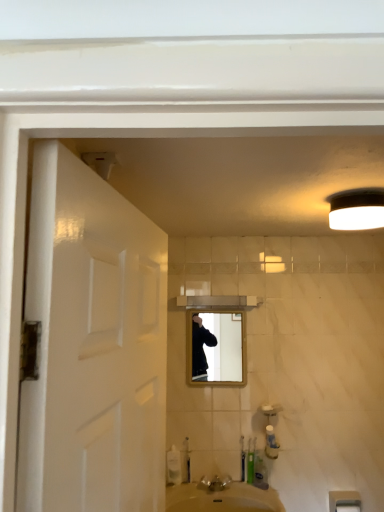
Image resolution: width=384 pixels, height=512 pixels. In order to click on green plastic toothbrush at lower center in this screenshot , I will do `click(250, 460)`.

Describe the element at coordinates (215, 483) in the screenshot. Image resolution: width=384 pixels, height=512 pixels. I see `silver metallic faucet at lower center` at that location.

Describe the element at coordinates (357, 209) in the screenshot. The height and width of the screenshot is (512, 384). I see `white matte light fixture at upper right` at that location.

What is the approximate width of white plastic soap dispenser at lower center?

The width of white plastic soap dispenser at lower center is 1.40 inches.

Locate an element on the screen. Image resolution: width=384 pixels, height=512 pixels. green plastic toothbrush at lower center is located at coordinates (250, 460).

Is white matte door at left spatially inside white plastic towel bar at lower right, or outside of it?

white matte door at left is outside white plastic towel bar at lower right.

Is point (102, 207) farther from viewer compared to point (329, 494)?

No, (102, 207) is closer to viewer.

Considering the relative positions of white matte door at left and white plastic towel bar at lower right in the image provided, is white matte door at left to the right of white plastic towel bar at lower right from the viewer's perspective?

No.

Is white matte door at left taller or shorter than white plastic towel bar at lower right?

Clearly, white matte door at left is taller compared to white plastic towel bar at lower right.

Based on the photo, which is less distant, (254, 458) or (345, 216)?

Point (254, 458) is farther from the camera than point (345, 216).

Would you say green plastic toothbrush at lower center is inside or outside white matte light fixture at upper right?

green plastic toothbrush at lower center cannot be found inside white matte light fixture at upper right.

How different are the orientations of green plastic toothbrush at lower center and white matte light fixture at upper right in degrees?

They differ by 2.58 degrees in their facing directions.

Considering the sizes of silver metallic faucet at lower center and green plastic toothbrush at lower center in the image, is silver metallic faucet at lower center bigger or smaller than green plastic toothbrush at lower center?

silver metallic faucet at lower center is bigger than green plastic toothbrush at lower center.

Between point (220, 477) and point (251, 458), which one is positioned behind?

Point (251, 458)

Is silver metallic faucet at lower center taller than green plastic toothbrush at lower center?

No.

From a real-world perspective, does silver metallic faucet at lower center stand above green plastic toothbrush at lower center?

No, from a real-world perspective, silver metallic faucet at lower center is not above green plastic toothbrush at lower center.

Is matte wooden mirror at center far from white matte light fixture at upper right?

That's right, there is a large distance between matte wooden mirror at center and white matte light fixture at upper right.

Looking at their sizes, would you say matte wooden mirror at center is wider or thinner than white matte light fixture at upper right?

matte wooden mirror at center is thinner than white matte light fixture at upper right.

From the image's perspective, is matte wooden mirror at center over white matte light fixture at upper right?

No, from the image's perspective, matte wooden mirror at center is not above white matte light fixture at upper right.

In the image, is matte wooden mirror at center positioned in front of or behind white matte light fixture at upper right?

matte wooden mirror at center is behind white matte light fixture at upper right.

Find the location of a particular element. mirror directly beneath the white matte light fixture at upper right (from a real-world perspective) is located at coordinates pyautogui.click(x=219, y=348).

Choose the correct answer: Is white matte light fixture at upper right inside matte wooden mirror at center or outside it?

white matte light fixture at upper right cannot be found inside matte wooden mirror at center.

Considering their positions, is white matte light fixture at upper right located in front of or behind matte wooden mirror at center?

Clearly, white matte light fixture at upper right is in front of matte wooden mirror at center.

Between white matte light fixture at upper right and matte wooden mirror at center, which one appears on the right side from the viewer's perspective?

Positioned to the right is white matte light fixture at upper right.

Can you confirm if matte wooden mirror at center is positioned to the left of white plastic towel bar at lower right?

Yes.

Does matte wooden mirror at center touch white plastic towel bar at lower right?

No, matte wooden mirror at center is not next to white plastic towel bar at lower right.

From the image's perspective, who appears lower, matte wooden mirror at center or white plastic towel bar at lower right?

white plastic towel bar at lower right.

Is matte wooden mirror at center oriented towards white plastic towel bar at lower right?

No, matte wooden mirror at center does not turn towards white plastic towel bar at lower right.

Consider the image. How many degrees apart are the facing directions of white plastic soap dispenser at lower center and green plastic toothbrush at lower center?

The angular difference between white plastic soap dispenser at lower center and green plastic toothbrush at lower center is 3.49 degrees.

Does white plastic soap dispenser at lower center have a greater width compared to green plastic toothbrush at lower center?

Yes, white plastic soap dispenser at lower center is wider than green plastic toothbrush at lower center.

Is the surface of white plastic soap dispenser at lower center in direct contact with green plastic toothbrush at lower center?

No, white plastic soap dispenser at lower center is not in contact with green plastic toothbrush at lower center.

Which of these two, white plastic soap dispenser at lower center or green plastic toothbrush at lower center, is smaller?

green plastic toothbrush at lower center.

Image resolution: width=384 pixels, height=512 pixels. I want to click on towel bar on the right side of white matte door at left, so click(344, 501).

Where is `light fixture that appears above the green plastic toothbrush at lower center (from the image's perspective)`? light fixture that appears above the green plastic toothbrush at lower center (from the image's perspective) is located at coordinates (357, 209).

Based on their spatial positions, is white plastic towel bar at lower right or matte wooden mirror at center further from green plastic toothbrush at lower center?

matte wooden mirror at center.

Which object lies further to the anchor point white matte door at left, matte wooden mirror at center or white plastic soap dispenser at lower center?

white plastic soap dispenser at lower center lies further to white matte door at left than the other object.

Based on their spatial positions, is matte wooden mirror at center or white matte door at left further from white plastic soap dispenser at lower center?

white matte door at left is positioned further to the anchor white plastic soap dispenser at lower center.

Which object lies further to the anchor point matte wooden mirror at center, green plastic toothbrush at lower center or silver metallic faucet at lower center?

The object further to matte wooden mirror at center is silver metallic faucet at lower center.

Looking at the image, which one is located further to white matte light fixture at upper right, silver metallic faucet at lower center or matte wooden mirror at center?

silver metallic faucet at lower center.

From the image, which object appears to be nearer to green plastic toothbrush at lower center, white plastic towel bar at lower right or silver metallic faucet at lower center?

silver metallic faucet at lower center.

Estimate the real-world distances between objects in this image. Which object is further from white matte door at left, white matte light fixture at upper right or green plastic toothbrush at lower center?

green plastic toothbrush at lower center lies further to white matte door at left than the other object.

Looking at the image, which one is located closer to white matte door at left, white plastic soap dispenser at lower center or silver metallic faucet at lower center?

The object closer to white matte door at left is silver metallic faucet at lower center.

At what (x,y) coordinates should I click in order to perform the action: click on light fixture between white matte door at left and silver metallic faucet at lower center in the front-back direction. Please return your answer as a coordinate pair (x, y). The width and height of the screenshot is (384, 512). Looking at the image, I should click on (357, 209).

Locate an element on the screen. This screenshot has height=512, width=384. toiletry between white matte door at left and matte wooden mirror at center along the z-axis is located at coordinates (250, 460).

Identify the location of tap between white plastic soap dispenser at lower center and white plastic towel bar at lower right from left to right. (215, 483).

The image size is (384, 512). I want to click on toiletry between white matte light fixture at upper right and white plastic towel bar at lower right in the vertical direction, so coord(250,460).